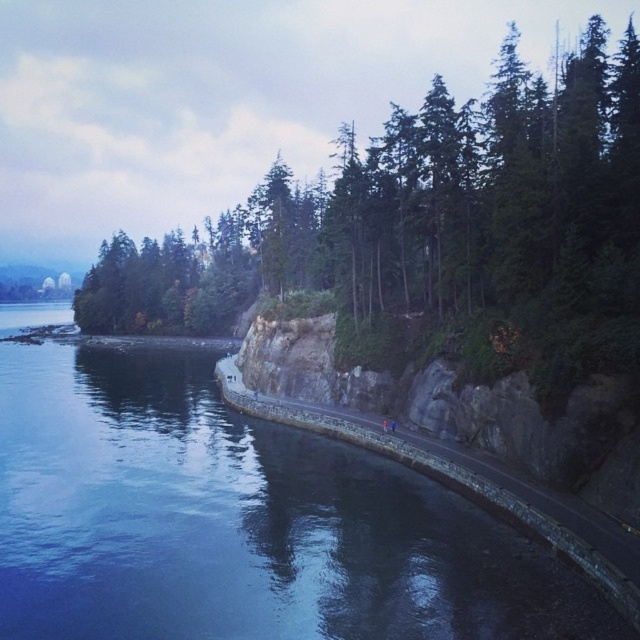
You are standing on the cliff overlooking the coastal scene. You see two points marked on the image. Which point is closer to you, point (225, 544) or point (428, 173)?

Point (225, 544) is closer to the viewer than point (428, 173).

You are standing at the edge of the cliff overlooking the coastal scene. You notice the green textured trees at center. Based on their position, can you determine if they are closer to the water or the cliff edge?

The green textured trees at center are located at point coordinates that place them closer to the cliff edge rather than the water. Since their coordinates are at 0.364 on the x and 0.686 on the y, they are positioned more towards the cliff side of the scene.

A hiker wants to take a photo of both the dark blue water at center and the green textured trees at center from a single viewpoint. Given that the camera has a maximum focal length that allows capturing objects up to 30 meters apart, will they be able to frame both subjects in one shot?

The dark blue water at center is 33.57 meters away from the green textured trees at center. Since the distance exceeds the camera maximum focal length of 30 meters, the hiker cannot frame both subjects in one shot.